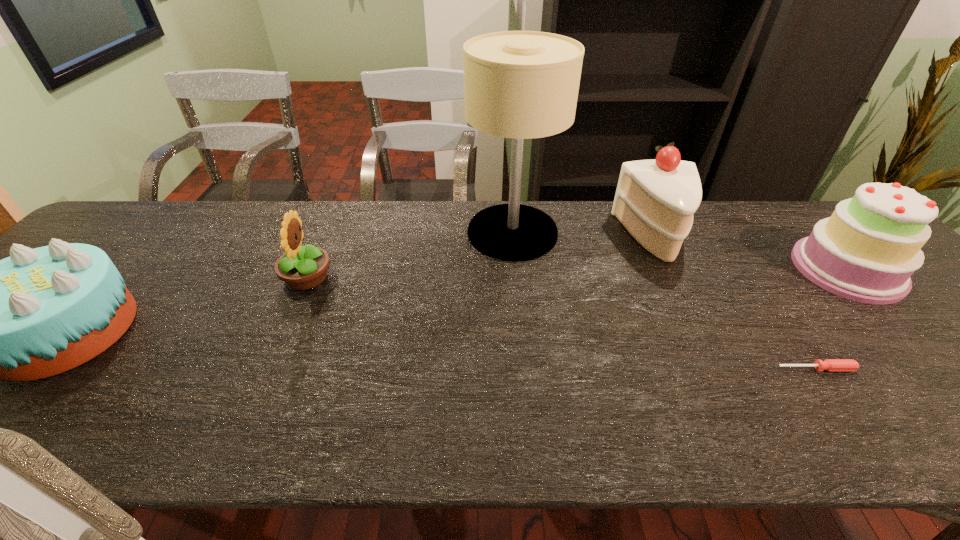
Find the location of `vacant space located on the face of the fifth object from right to left`. vacant space located on the face of the fifth object from right to left is located at coordinates (355, 278).

At what (x,y) coordinates should I click in order to perform the action: click on vacant space located 0.060m on the right of the shortest object. Please return your answer as a coordinate pair (x, y). The height and width of the screenshot is (540, 960). Looking at the image, I should click on (883, 369).

Locate an element on the screen. The image size is (960, 540). table lamp located in the far edge section of the desktop is located at coordinates (522, 85).

Find the location of a particular element. object situated at the right edge is located at coordinates (867, 250).

This screenshot has width=960, height=540. In order to click on object present at the far right corner in this screenshot , I will do pyautogui.click(x=867, y=250).

The height and width of the screenshot is (540, 960). In the image, there is a desktop. What are the coordinates of `vacant area at the far edge` in the screenshot? It's located at (335, 210).

The height and width of the screenshot is (540, 960). Identify the location of vacant space at the near edge of the desktop. (39, 416).

Identify the location of vacant space at the right edge. (956, 368).

Find the location of `free space at the far left corner of the desktop`. free space at the far left corner of the desktop is located at coordinates (132, 201).

This screenshot has height=540, width=960. Find the location of `free space between the shortest object and the rightmost cake`. free space between the shortest object and the rightmost cake is located at coordinates (831, 319).